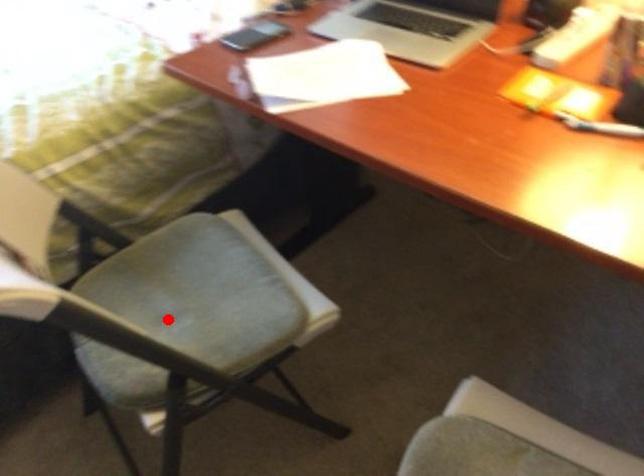
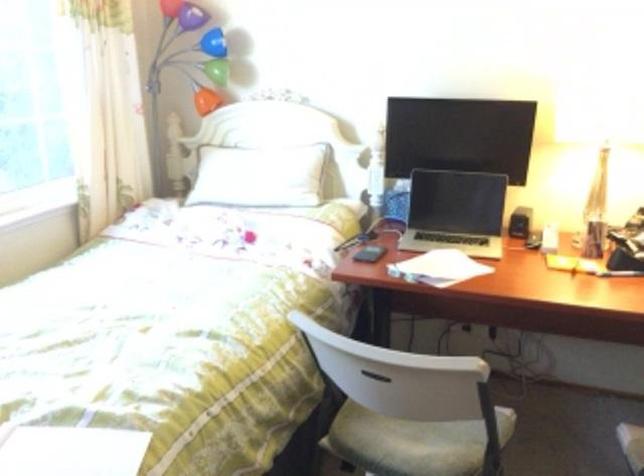
In the second image, find the point that corresponds to the highlighted location in the first image.

(413, 442)